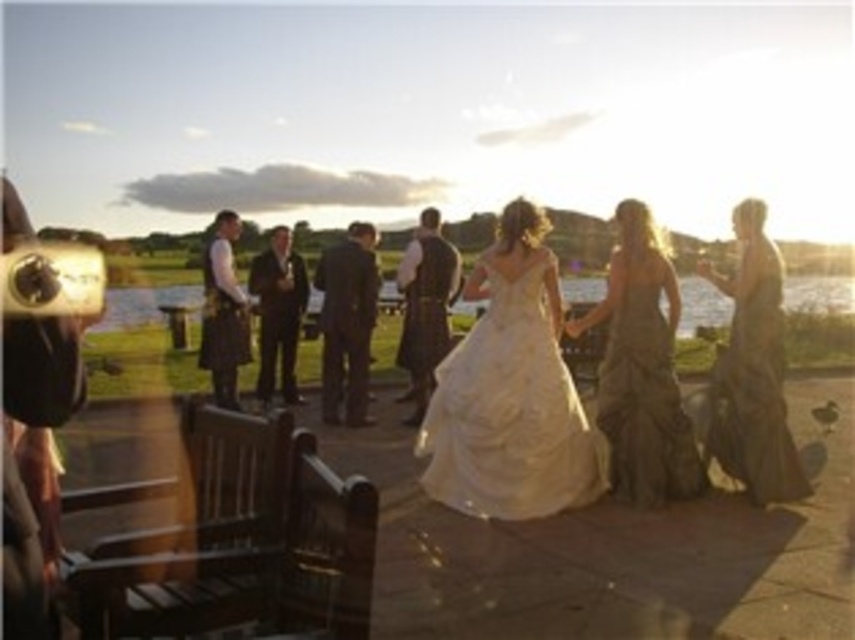
Based on the photo, you are a photographer trying to capture the bride and groom in the scene. The ivory satin gown at center belongs to the bride, and the dark suit at center belongs to the groom. Based on their positions, which direction should you move to frame both of them equally in your shot?

The ivory satin gown at center is positioned on the right side of dark suit at center. To frame both equally, move to the left so that both the ivory satin gown at center and dark suit at center are centered in your viewfinder.

You are a photographer trying to capture the bride and groom in the scene. The ivory satin gown at center belongs to the bride, and the dark suit at center belongs to the groom. Based on their positions, which one is closer to the ground?

The ivory satin gown at center is located below dark suit at center, so the bride in the ivory satin gown at center is closer to the ground than the groom in the dark suit at center.